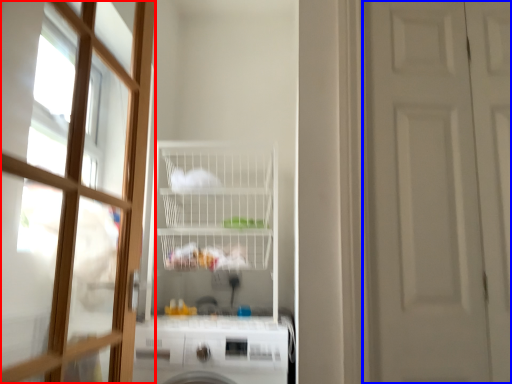
Question: Which of the following is the closest to the observer, door (highlighted by a red box) or door (highlighted by a blue box)?

Choices:
 (A) door
 (B) door

Answer: (A)